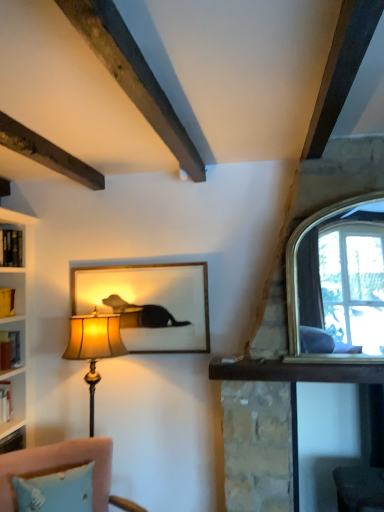
Question: Is matte gold lampshade at left wider than matte glass picture frame at center?

Choices:
 (A) no
 (B) yes

Answer: (B)

Question: Considering the relative positions of matte gold lampshade at left and matte glass picture frame at center in the image provided, is matte gold lampshade at left in front of matte glass picture frame at center?

Choices:
 (A) no
 (B) yes

Answer: (B)

Question: Can you confirm if matte gold lampshade at left is shorter than matte glass picture frame at center?

Choices:
 (A) no
 (B) yes

Answer: (A)

Question: From the image's perspective, would you say matte gold lampshade at left is shown under matte glass picture frame at center?

Choices:
 (A) yes
 (B) no

Answer: (A)

Question: Considering the relative sizes of matte gold lampshade at left and matte glass picture frame at center in the image provided, is matte gold lampshade at left bigger than matte glass picture frame at center?

Choices:
 (A) yes
 (B) no

Answer: (A)

Question: From a real-world perspective, is velvet pink sofa at lower left physically located above or below hardcover book at left?

Choices:
 (A) below
 (B) above

Answer: (A)

Question: Considering the relative positions of velvet pink sofa at lower left and hardcover book at left in the image provided, is velvet pink sofa at lower left to the left or to the right of hardcover book at left?

Choices:
 (A) left
 (B) right

Answer: (B)

Question: In terms of size, does velvet pink sofa at lower left appear bigger or smaller than hardcover book at left?

Choices:
 (A) big
 (B) small

Answer: (A)

Question: Is point (99, 502) closer or farther from the camera than point (1, 349)?

Choices:
 (A) closer
 (B) farther

Answer: (A)

Question: Does point (91, 317) appear closer or farther from the camera than point (185, 289)?

Choices:
 (A) farther
 (B) closer

Answer: (B)

Question: Based on their positions, is matte gold lampshade at left located to the left or right of matte glass picture frame at center?

Choices:
 (A) left
 (B) right

Answer: (A)

Question: From the image's perspective, is matte gold lampshade at left above or below matte glass picture frame at center?

Choices:
 (A) above
 (B) below

Answer: (B)

Question: From a real-world perspective, is matte gold lampshade at left above or below matte glass picture frame at center?

Choices:
 (A) above
 (B) below

Answer: (B)

Question: Considering the positions of matte glass picture frame at center and velvet pink sofa at lower left in the image, is matte glass picture frame at center wider or thinner than velvet pink sofa at lower left?

Choices:
 (A) wide
 (B) thin

Answer: (B)

Question: Visually, is matte glass picture frame at center positioned to the left or to the right of velvet pink sofa at lower left?

Choices:
 (A) right
 (B) left

Answer: (A)